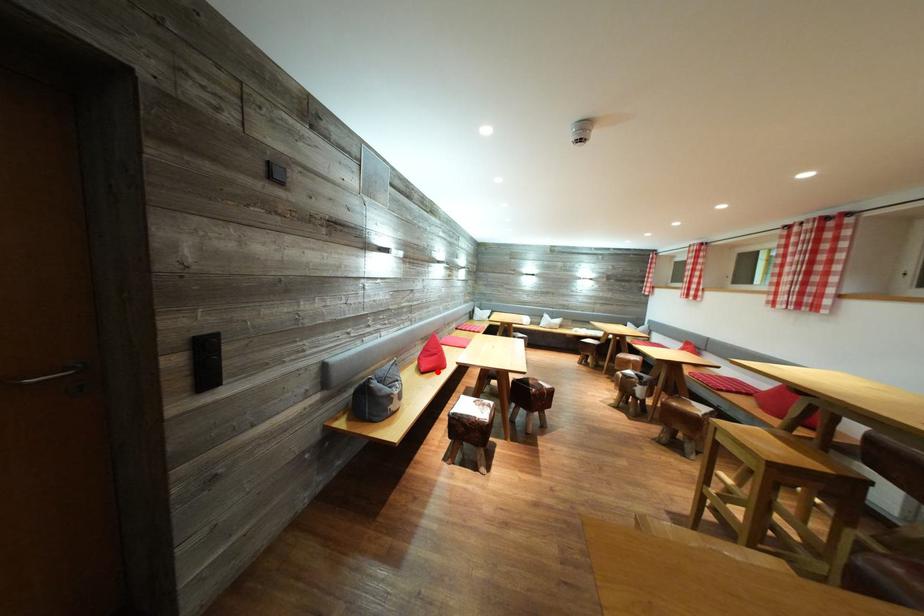
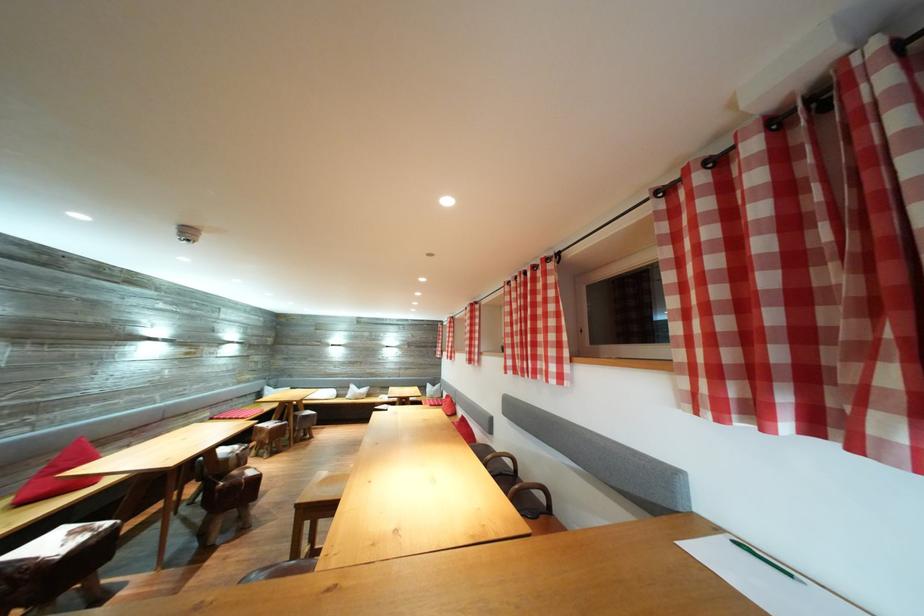
Question: I am providing you with two images of the same scene from different viewpoints. In image1, a red point is highlighted. Considering the same 3D point in image2, which of the following is correct?

Choices:
 (A) It is closer
 (B) It is farther

Answer: (A)